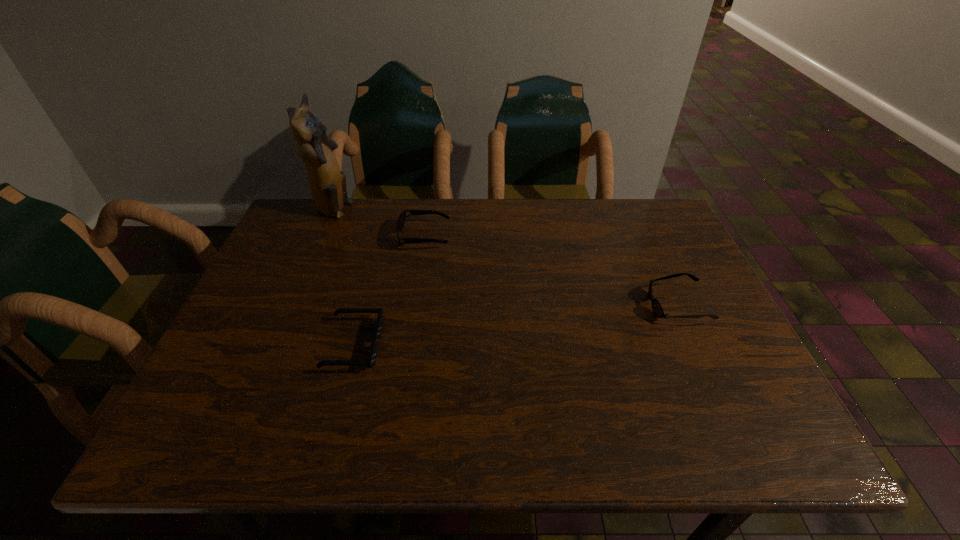
This screenshot has height=540, width=960. Identify the location of vacant area between the cat and the rightmost sunglasses. (505, 258).

Find the location of a particular element. free space between the rightmost object and the farthest sunglasses is located at coordinates (550, 271).

Identify the location of free point between the rightmost object and the farthest sunglasses. This screenshot has height=540, width=960. (550, 271).

Locate which object is the third closest to the shortest sunglasses. Please provide its 2D coordinates. Your answer should be formatted as a tuple, i.e. [(x, y)], where the tuple contains the x and y coordinates of a point satisfying the conditions above.

[(657, 308)]

Locate which object is the third closest to the rightmost sunglasses. Please provide its 2D coordinates. Your answer should be formatted as a tuple, i.e. [(x, y)], where the tuple contains the x and y coordinates of a point satisfying the conditions above.

[(327, 183)]

Where is `sunglasses that can be found as the closest to the rightmost object`? The width and height of the screenshot is (960, 540). sunglasses that can be found as the closest to the rightmost object is located at coordinates (402, 217).

Locate an element on the screen. The height and width of the screenshot is (540, 960). sunglasses identified as the second closest to the rightmost object is located at coordinates (373, 352).